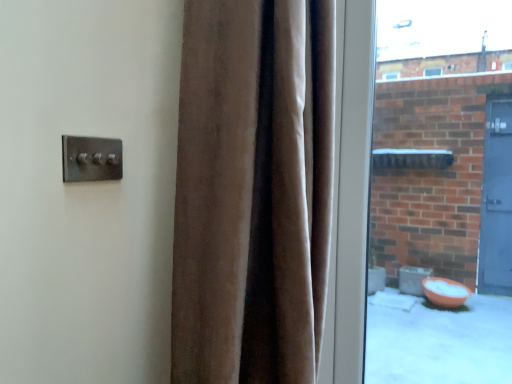
Question: Is satin silver switch at upper left not close to velvet brown curtain at center?

Choices:
 (A) no
 (B) yes

Answer: (A)

Question: From a real-world perspective, does satin silver switch at upper left stand above velvet brown curtain at center?

Choices:
 (A) no
 (B) yes

Answer: (B)

Question: Can you confirm if satin silver switch at upper left is bigger than velvet brown curtain at center?

Choices:
 (A) no
 (B) yes

Answer: (A)

Question: Is satin silver switch at upper left not within velvet brown curtain at center?

Choices:
 (A) no
 (B) yes

Answer: (B)

Question: Considering the relative sizes of satin silver switch at upper left and velvet brown curtain at center in the image provided, is satin silver switch at upper left shorter than velvet brown curtain at center?

Choices:
 (A) yes
 (B) no

Answer: (A)

Question: From a real-world perspective, is velvet brown curtain at center above or below clear glass window at right?

Choices:
 (A) above
 (B) below

Answer: (B)

Question: From the image's perspective, is velvet brown curtain at center above or below clear glass window at right?

Choices:
 (A) below
 (B) above

Answer: (A)

Question: Is point (290, 377) closer or farther from the camera than point (455, 23)?

Choices:
 (A) closer
 (B) farther

Answer: (A)

Question: From their relative heights in the image, would you say velvet brown curtain at center is taller or shorter than clear glass window at right?

Choices:
 (A) tall
 (B) short

Answer: (B)

Question: From a real-world perspective, relative to velvet brown curtain at center, is clear glass window at right vertically above or below?

Choices:
 (A) above
 (B) below

Answer: (A)

Question: In terms of width, does clear glass window at right look wider or thinner when compared to velvet brown curtain at center?

Choices:
 (A) thin
 (B) wide

Answer: (A)

Question: Is clear glass window at right in front of or behind velvet brown curtain at center in the image?

Choices:
 (A) front
 (B) behind

Answer: (B)

Question: From their relative heights in the image, would you say clear glass window at right is taller or shorter than velvet brown curtain at center?

Choices:
 (A) tall
 (B) short

Answer: (A)

Question: Is satin silver switch at upper left taller or shorter than clear glass window at right?

Choices:
 (A) short
 (B) tall

Answer: (A)

Question: From a real-world perspective, is satin silver switch at upper left above or below clear glass window at right?

Choices:
 (A) above
 (B) below

Answer: (A)